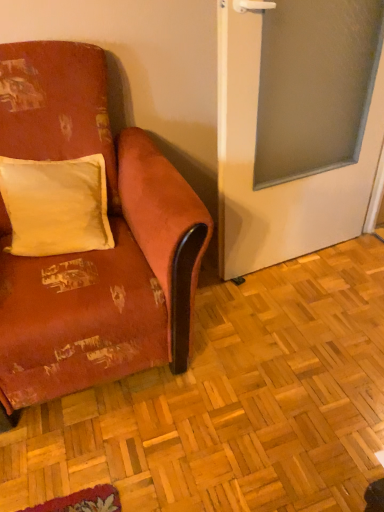
Question: From the image's perspective, is frosted glass screen door at right positioned above or below white soft cushion at upper left?

Choices:
 (A) below
 (B) above

Answer: (B)

Question: Considering the positions of frosted glass screen door at right and white soft cushion at upper left in the image, is frosted glass screen door at right taller or shorter than white soft cushion at upper left?

Choices:
 (A) short
 (B) tall

Answer: (B)

Question: Estimate the real-world distances between objects in this image. Which object is farther from the velvet-like orange couch at left?

Choices:
 (A) white soft cushion at upper left
 (B) frosted glass screen door at right

Answer: (B)

Question: Considering the real-world distances, which object is farthest from the white soft cushion at upper left?

Choices:
 (A) frosted glass screen door at right
 (B) velvet-like orange couch at left

Answer: (A)